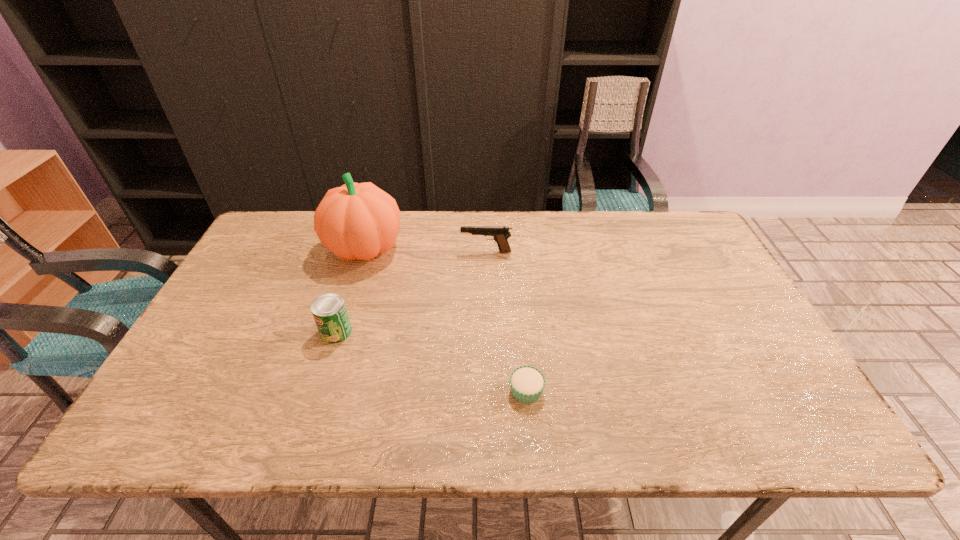
You are a GUI agent. You are given a task and a screenshot of the screen. Output one action in this format:
    pyautogui.click(x=<x>, y=<y>)
    Task: Click on the pumpkin
    The width and height of the screenshot is (960, 540).
    Given the screenshot: What is the action you would take?
    pyautogui.click(x=358, y=221)

Identify the location of the second nearest object. (329, 311).

Locate an element on the screen. pistol is located at coordinates (500, 234).

What are the coordinates of `cupcake` in the screenshot? It's located at pos(527,383).

The height and width of the screenshot is (540, 960). Identify the location of the shortest object. (527, 383).

This screenshot has width=960, height=540. I want to click on vacant area situated 0.080m on the back of the tallest object, so click(x=375, y=212).

In order to click on vacant position located 0.240m on the right of the can in this screenshot , I will do `click(444, 332)`.

At what (x,y) coordinates should I click in order to perform the action: click on vacant region located 0.050m at the muzzle of the pistol. Please return your answer as a coordinate pair (x, y). The width and height of the screenshot is (960, 540). Looking at the image, I should click on (445, 252).

Identify the location of vacant space located at the muzzle of the pistol. 391,252.

Where is `vacant area situated at the muzzle of the pistol`? This screenshot has width=960, height=540. vacant area situated at the muzzle of the pistol is located at coordinates pyautogui.click(x=346, y=252).